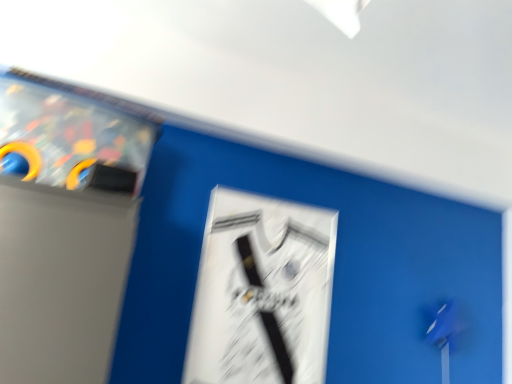
The height and width of the screenshot is (384, 512). What do you see at coordinates (262, 292) in the screenshot?
I see `white glossy poster at center` at bounding box center [262, 292].

You are a GUI agent. You are given a task and a screenshot of the screen. Output one action in this format:
    pyautogui.click(x=<x>, y=<y>)
    Task: Click on the white glossy poster at center
    
    Given the screenshot: What is the action you would take?
    pyautogui.click(x=262, y=292)

This screenshot has width=512, height=384. In order to click on white glossy poster at center in this screenshot , I will do `click(262, 292)`.